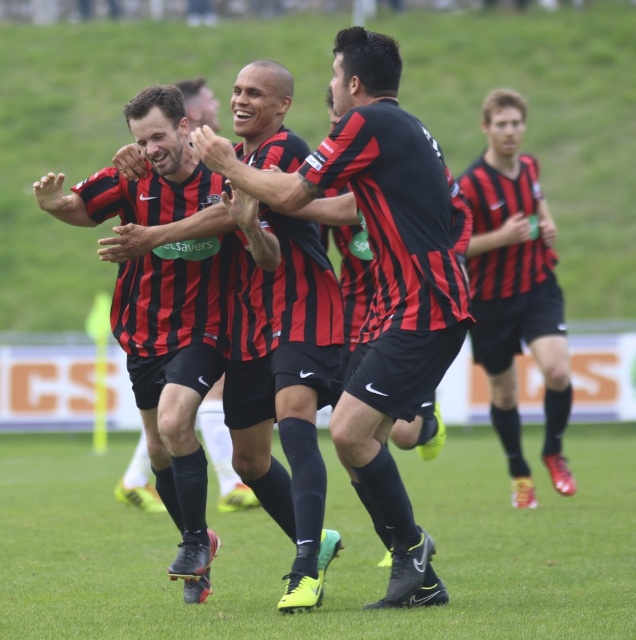
Consider the image. You are a photographer standing at the edge of the soccer field. You want to take a closeup shot of the matte black jersey at center. Considering your current position, can you estimate how far you need to move forward to get the jersey into focus?

The matte black jersey at center is 32.15 feet from viewer. To get it into focus, you need to move forward approximately 32.15 feet.

From the picture: You are a photographer trying to capture a closeup of the green grass at center and the matte black jersey at center. Which object should you focus on if you want the one that is closer to the camera?

The green grass at center has a lesser height compared to matte black jersey at center, so it is closer to the camera. Focus on the green grass at center.

You are a photographer trying to capture a wide shot of the soccer players. You notice the green grass at center and the matte black shorts at right in your viewfinder. Which object should you focus on if you want to include more of the background in your photo?

The green grass at center has a larger width than the matte black shorts at right, so focusing on the green grass at center would allow more background to be included in the photo.